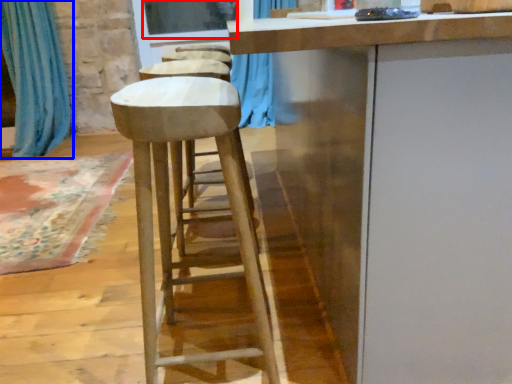
Question: Which of the following is the farthest to the observer, window screen (highlighted by a red box) or curtain (highlighted by a blue box)?

Choices:
 (A) window screen
 (B) curtain

Answer: (A)